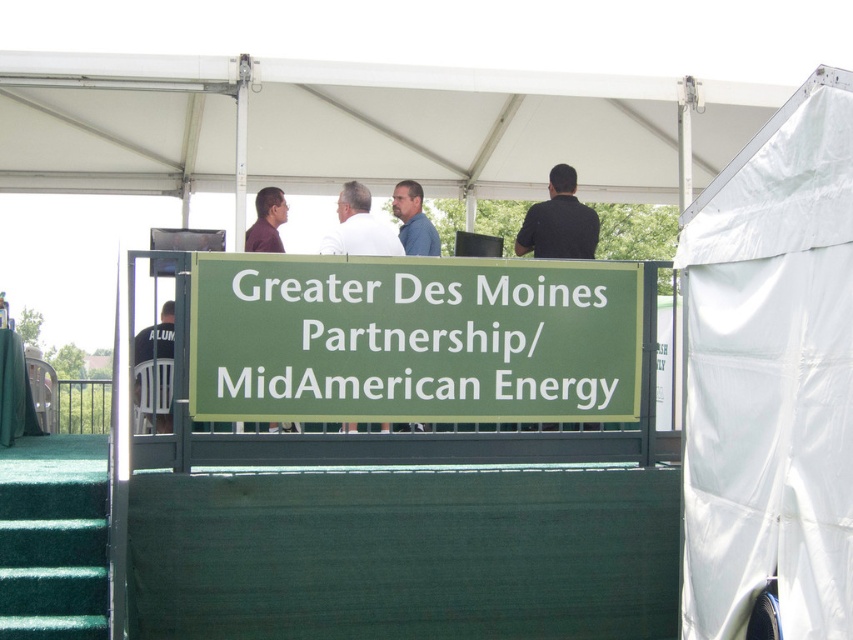
You are attending a networking event and see two people in the foreground. One is wearing a white matte shirt at center and the other is wearing a black jersey at left. Which person is closer to you?

The white matte shirt at center is shorter than the black jersey at left, so the person wearing the white matte shirt at center is closer to you.

You are attending a networking event and see two people in the crowd. One is wearing a blue shirt at center and another is wearing a black jersey at left. Which person is closer to you?

The blue shirt at center is closer to you because the black jersey at left is behind it.